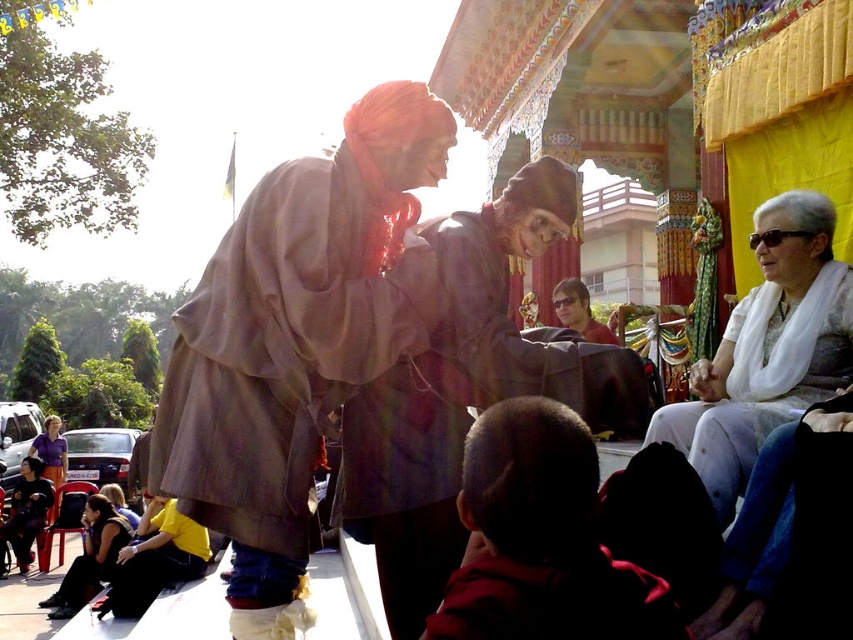
Question: Can you confirm if dark red fabric at lower center is thinner than matte brown jacket at center?

Choices:
 (A) no
 (B) yes

Answer: (A)

Question: Where is brown textured robe at center located in relation to dark red fabric at lower center in the image?

Choices:
 (A) right
 (B) left

Answer: (B)

Question: Is white sheer robe at upper right thinner than purple cotton shirt at lower left?

Choices:
 (A) no
 (B) yes

Answer: (B)

Question: Which object is closer to the camera taking this photo?

Choices:
 (A) yellow cotton shirt at lower left
 (B) purple cotton shirt at lower left

Answer: (A)

Question: Which point appears closest to the camera in this image?

Choices:
 (A) (584, 476)
 (B) (82, 536)
 (C) (711, 483)

Answer: (A)

Question: Which point is closer to the camera?

Choices:
 (A) (408, 536)
 (B) (646, 627)
 (C) (572, 285)
 (D) (108, 513)

Answer: (B)